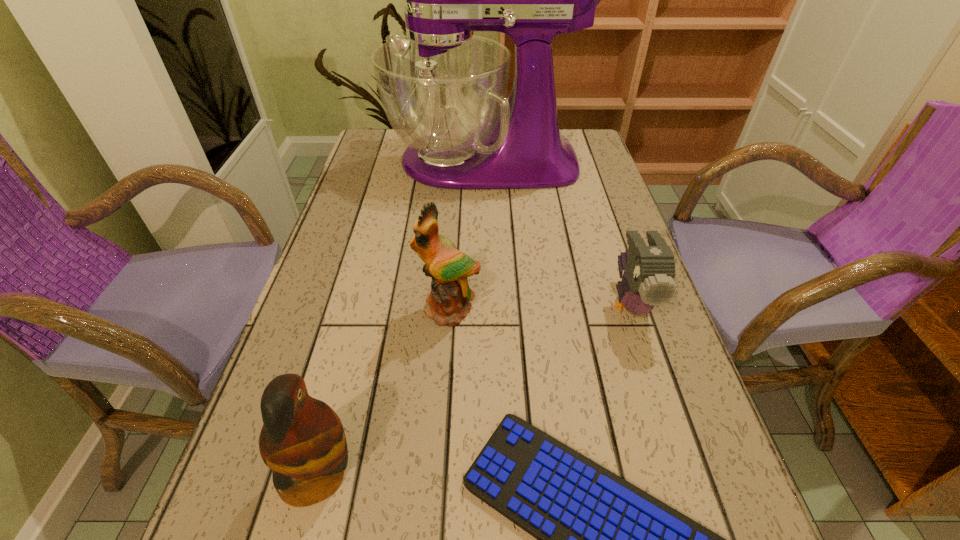
You are a GUI agent. You are given a task and a screenshot of the screen. Output one action in this format:
    pyautogui.click(x=<x>, y=<y>)
    Task: Click on the blank area in the image that satisfies the following two spatial constraints: 1. at the bowl opening of the farthest object; 2. on the front-facing side of the right parrot
    
    Given the screenshot: What is the action you would take?
    484,310

Find the location of a particular element. This screenshot has width=960, height=540. vacant space that satisfies the following two spatial constraints: 1. at the beak of the fourth tallest object; 2. on the face of the nearer parrot is located at coordinates (687, 475).